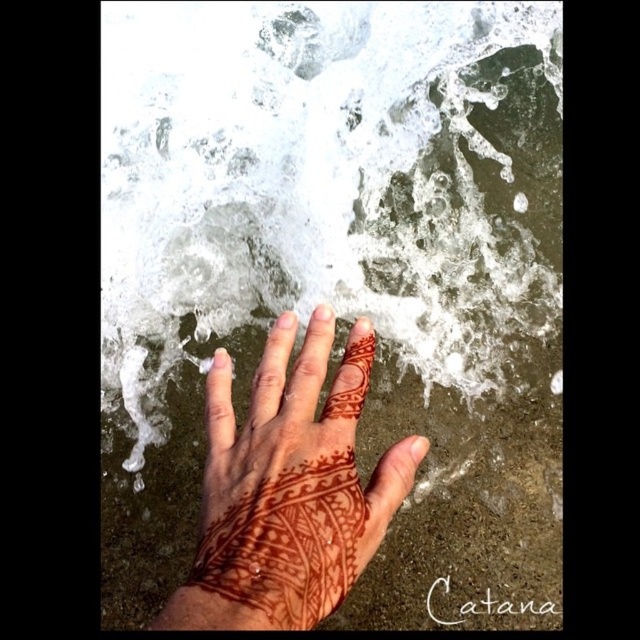
Question: Is white frothy water at center above brown henna tattoo at center?

Choices:
 (A) no
 (B) yes

Answer: (B)

Question: Where is white frothy water at center located in relation to brown henna tattoo at center in the image?

Choices:
 (A) left
 (B) right

Answer: (B)

Question: Which of the following is the farthest from the observer?

Choices:
 (A) brown henna tattoo at center
 (B) white frothy water at center

Answer: (B)

Question: Does white frothy water at center have a greater width compared to brown henna tattoo at center?

Choices:
 (A) no
 (B) yes

Answer: (B)